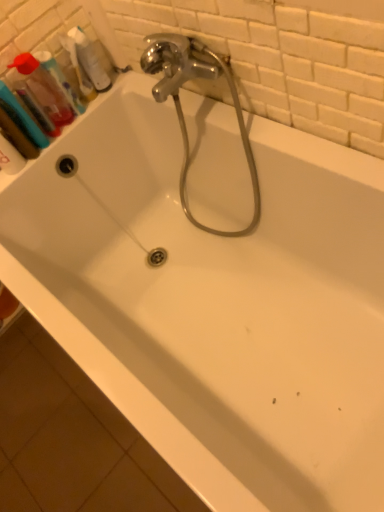
Question: Is translucent plastic bottle at upper left facing towards translucent plastic mouthwash at upper left, marked as the third mouthwash in a right-to-left arrangement?

Choices:
 (A) no
 (B) yes

Answer: (A)

Question: From the image's perspective, is translucent plastic bottle at upper left located beneath translucent plastic mouthwash at upper left, which ranks as the 1th mouthwash in left-to-right order?

Choices:
 (A) yes
 (B) no

Answer: (B)

Question: Is translucent plastic bottle at upper left bigger than translucent plastic mouthwash at upper left, marked as the third mouthwash in a right-to-left arrangement?

Choices:
 (A) no
 (B) yes

Answer: (A)

Question: Does translucent plastic bottle at upper left have a lesser width compared to translucent plastic mouthwash at upper left, which ranks as the 1th mouthwash in left-to-right order?

Choices:
 (A) yes
 (B) no

Answer: (A)

Question: Is translucent plastic bottle at upper left to the left of translucent plastic mouthwash at upper left, marked as the third mouthwash in a right-to-left arrangement, from the viewer's perspective?

Choices:
 (A) no
 (B) yes

Answer: (A)

Question: Is translucent plastic mouthwash at upper left, the second mouthwash from the right, in front of or behind translucent plastic bottle at upper left in the image?

Choices:
 (A) front
 (B) behind

Answer: (A)

Question: From the image's perspective, is translucent plastic mouthwash at upper left, the second mouthwash from the right, located above or below translucent plastic bottle at upper left?

Choices:
 (A) above
 (B) below

Answer: (B)

Question: Looking at their shapes, would you say translucent plastic mouthwash at upper left, which is counted as the 2th mouthwash, starting from the left, is wider or thinner than translucent plastic bottle at upper left?

Choices:
 (A) wide
 (B) thin

Answer: (A)

Question: From their relative heights in the image, would you say translucent plastic mouthwash at upper left, which is counted as the 2th mouthwash, starting from the left, is taller or shorter than translucent plastic bottle at upper left?

Choices:
 (A) short
 (B) tall

Answer: (B)

Question: In terms of height, does translucent plastic bottle at upper left look taller or shorter compared to translucent plastic mouthwash at upper left, which is counted as the 2th mouthwash, starting from the left?

Choices:
 (A) tall
 (B) short

Answer: (B)

Question: From the image's perspective, is translucent plastic bottle at upper left located above or below translucent plastic mouthwash at upper left, the second mouthwash from the right?

Choices:
 (A) below
 (B) above

Answer: (B)

Question: Relative to translucent plastic mouthwash at upper left, the second mouthwash from the right, is translucent plastic bottle at upper left in front or behind?

Choices:
 (A) behind
 (B) front

Answer: (A)

Question: Is point (79, 34) closer or farther from the camera than point (31, 71)?

Choices:
 (A) farther
 (B) closer

Answer: (A)

Question: Is translucent plastic mouthwash at upper left, which ranks as the third mouthwash in left-to-right order, spatially inside translucent plastic bottle at upper left, or outside of it?

Choices:
 (A) inside
 (B) outside

Answer: (B)

Question: Based on their positions, is translucent plastic mouthwash at upper left, positioned as the 1th mouthwash in right-to-left order, located to the left or right of translucent plastic bottle at upper left?

Choices:
 (A) right
 (B) left

Answer: (B)